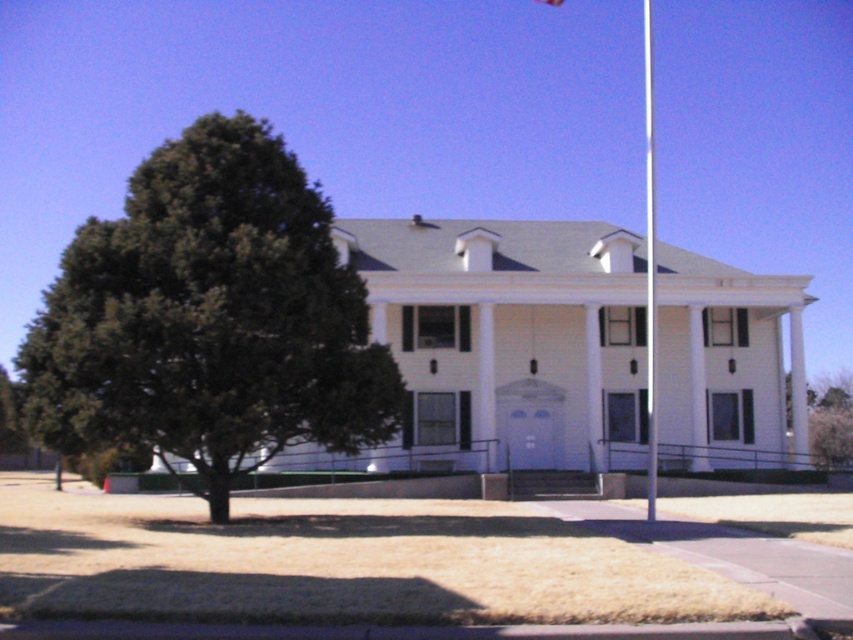
Can you confirm if green leafy tree at left is bigger than white glossy flag pole at center?

No, green leafy tree at left is not bigger than white glossy flag pole at center.

Between green leafy tree at left and white glossy flag pole at center, which one appears on the right side from the viewer's perspective?

white glossy flag pole at center

Is point (44, 436) positioned behind point (651, 416)?

No, it is in front of (651, 416).

The height and width of the screenshot is (640, 853). Find the location of `green leafy tree at left`. green leafy tree at left is located at coordinates (209, 317).

Can you confirm if green leafy tree at left is smaller than white fabric flag at upper center?

Incorrect, green leafy tree at left is not smaller in size than white fabric flag at upper center.

Looking at this image, between green leafy tree at left and white fabric flag at upper center, which one is positioned higher?

white fabric flag at upper center is higher up.

What do you see at coordinates (209, 317) in the screenshot? I see `green leafy tree at left` at bounding box center [209, 317].

I want to click on green leafy tree at left, so click(209, 317).

Does green leafy tree at left appear over green leafy tree at center?

Correct, green leafy tree at left is located above green leafy tree at center.

Looking at this image, does green leafy tree at left have a greater width compared to green leafy tree at center?

Incorrect, green leafy tree at left's width does not surpass green leafy tree at center's.

Who is more forward, (380, 346) or (833, 381)?

Point (380, 346)

At what (x,y) coordinates should I click in order to perform the action: click on green leafy tree at left. Please return your answer as a coordinate pair (x, y). Image resolution: width=853 pixels, height=640 pixels. Looking at the image, I should click on (209, 317).